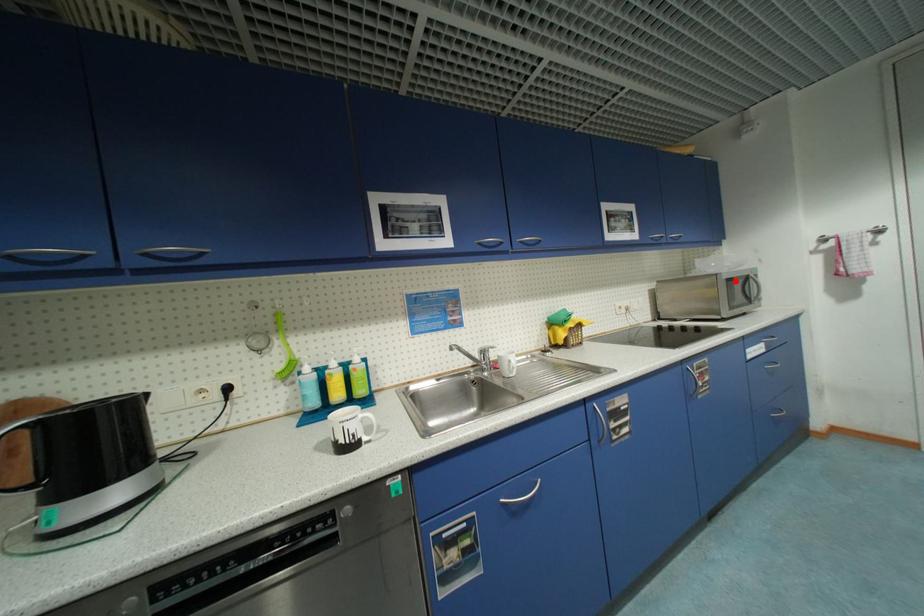
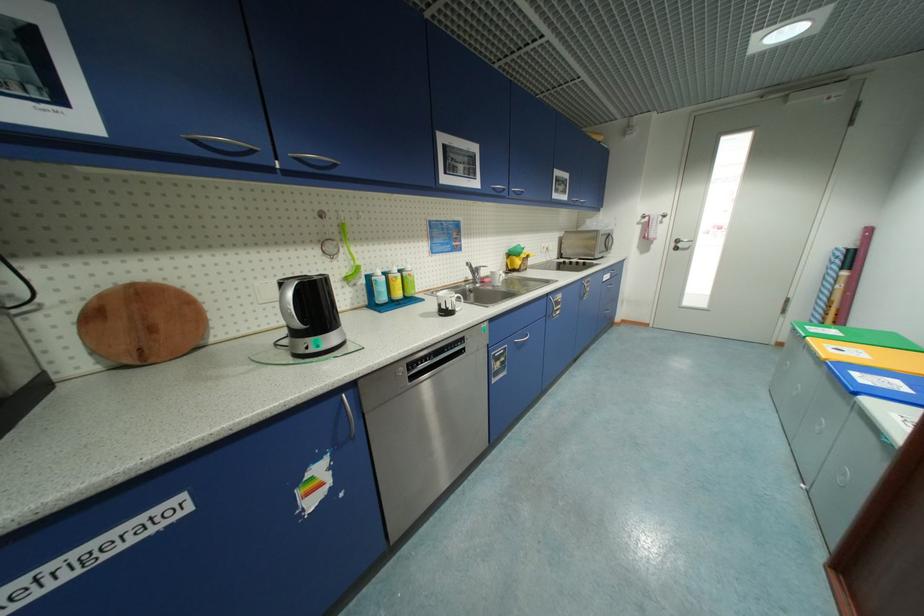
Locate, in the second image, the point that corresponds to the highlighted location in the first image.

(609, 236)